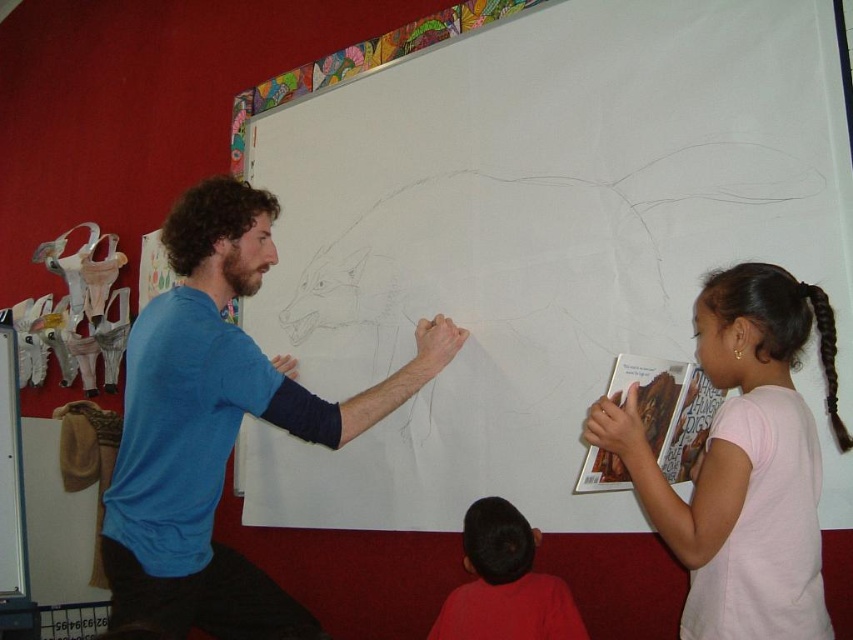
Is point (550, 20) more distant than point (822, 305)?

Yes, it is.

In order to click on white paper at upper center in this screenshot , I will do `click(534, 240)`.

Is white paper at upper center below smooth red shirt at lower center?

No, white paper at upper center is not below smooth red shirt at lower center.

Between point (746, 180) and point (479, 564), which one is positioned behind?

Point (479, 564)

Where is `white paper at upper center`? white paper at upper center is located at coordinates (534, 240).

Can you confirm if white paper at upper center is shorter than blue cotton shirt at center?

No, white paper at upper center is not shorter than blue cotton shirt at center.

Does white paper at upper center appear over blue cotton shirt at center?

Yes, white paper at upper center is above blue cotton shirt at center.

Which is in front, point (485, 481) or point (258, 388)?

Point (258, 388) is more forward.

Identify the location of white paper at upper center. Image resolution: width=853 pixels, height=640 pixels. (534, 240).